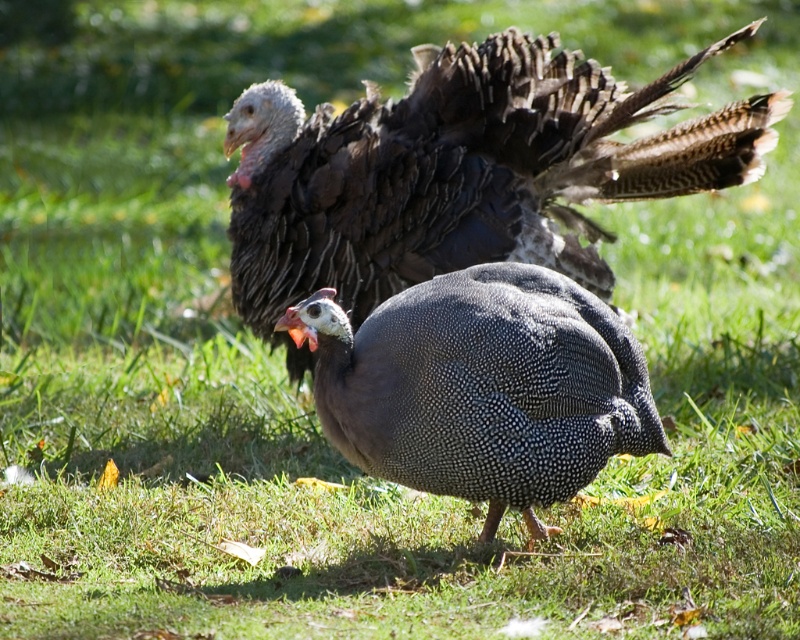
Question: Which object appears closest to the camera in this image?

Choices:
 (A) speckled feathered guinea fowl at center
 (B) dark brown feathers at upper center

Answer: (A)

Question: Can you confirm if dark brown feathers at upper center is positioned to the left of speckled feathered guinea fowl at center?

Choices:
 (A) no
 (B) yes

Answer: (A)

Question: Observing the image, what is the correct spatial positioning of dark brown feathers at upper center in reference to speckled feathered guinea fowl at center?

Choices:
 (A) right
 (B) left

Answer: (A)

Question: Can you confirm if dark brown feathers at upper center is bigger than speckled feathered guinea fowl at center?

Choices:
 (A) no
 (B) yes

Answer: (B)